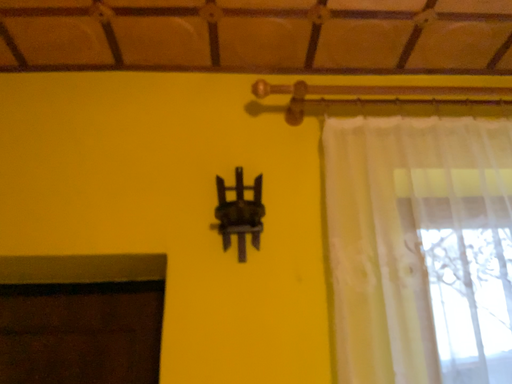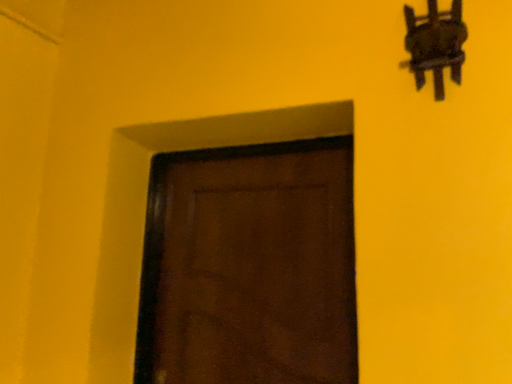
Question: Which way did the camera rotate in the video?

Choices:
 (A) rotated upward
 (B) rotated downward

Answer: (B)